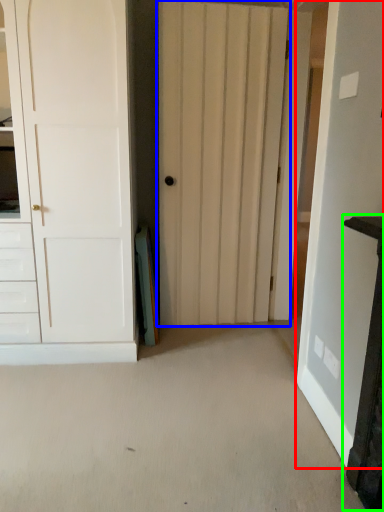
Question: Which object is positioned farthest from door (highlighted by a red box)? Select from door (highlighted by a blue box) and vanity (highlighted by a green box).

Choices:
 (A) door
 (B) vanity

Answer: (A)